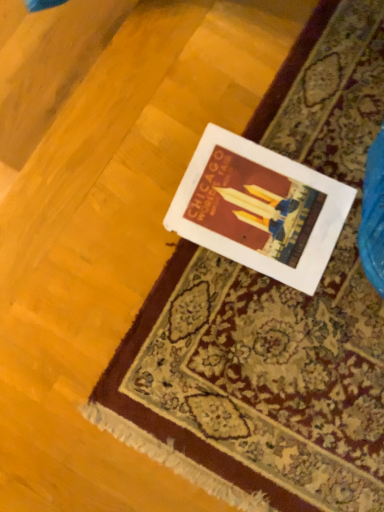
Locate an element on the screen. This screenshot has height=512, width=384. unoccupied area behind matte paper book at center is located at coordinates (300, 101).